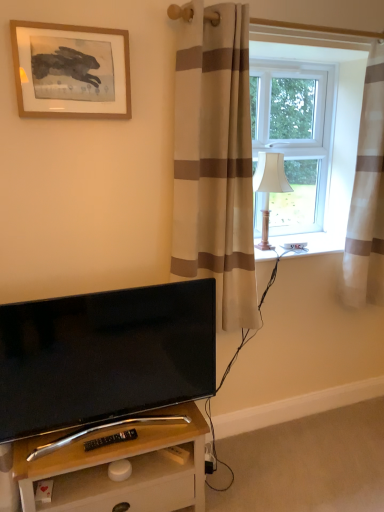
Question: Considering the relative sizes of beige striped curtain at right, the 2th curtain viewed from the left, and black glossy tv at lower left in the image provided, is beige striped curtain at right, the 2th curtain viewed from the left, thinner than black glossy tv at lower left?

Choices:
 (A) no
 (B) yes

Answer: (A)

Question: Can you confirm if beige striped curtain at right, the 2th curtain viewed from the left, is bigger than black glossy tv at lower left?

Choices:
 (A) yes
 (B) no

Answer: (A)

Question: Considering the relative sizes of beige striped curtain at right, marked as the 1th curtain in a right-to-left arrangement, and black glossy tv at lower left in the image provided, is beige striped curtain at right, marked as the 1th curtain in a right-to-left arrangement, shorter than black glossy tv at lower left?

Choices:
 (A) yes
 (B) no

Answer: (B)

Question: Considering the relative sizes of beige striped curtain at right, the 2th curtain viewed from the left, and black glossy tv at lower left in the image provided, is beige striped curtain at right, the 2th curtain viewed from the left, taller than black glossy tv at lower left?

Choices:
 (A) no
 (B) yes

Answer: (B)

Question: Does beige striped curtain at right, marked as the 1th curtain in a right-to-left arrangement, appear on the left side of black glossy tv at lower left?

Choices:
 (A) yes
 (B) no

Answer: (B)

Question: Can you confirm if beige striped curtain at right, marked as the 1th curtain in a right-to-left arrangement, is positioned to the right of black glossy tv at lower left?

Choices:
 (A) no
 (B) yes

Answer: (B)

Question: Considering the relative sizes of beige striped curtain at center, positioned as the second curtain in right-to-left order, and black glossy tv at lower left in the image provided, is beige striped curtain at center, positioned as the second curtain in right-to-left order, wider than black glossy tv at lower left?

Choices:
 (A) yes
 (B) no

Answer: (A)

Question: Can you confirm if beige striped curtain at center, placed as the 1th curtain when sorted from left to right, is smaller than black glossy tv at lower left?

Choices:
 (A) yes
 (B) no

Answer: (B)

Question: Would you say beige striped curtain at center, placed as the 1th curtain when sorted from left to right, is outside black glossy tv at lower left?

Choices:
 (A) no
 (B) yes

Answer: (B)

Question: Is beige striped curtain at center, placed as the 1th curtain when sorted from left to right, positioned with its back to black glossy tv at lower left?

Choices:
 (A) no
 (B) yes

Answer: (A)

Question: Does beige striped curtain at center, positioned as the second curtain in right-to-left order, have a larger size compared to black glossy tv at lower left?

Choices:
 (A) yes
 (B) no

Answer: (A)

Question: From a real-world perspective, is beige striped curtain at center, positioned as the second curtain in right-to-left order, beneath black glossy tv at lower left?

Choices:
 (A) no
 (B) yes

Answer: (A)

Question: Are black glossy tv at lower left and white fabric lampshade at right making contact?

Choices:
 (A) no
 (B) yes

Answer: (A)